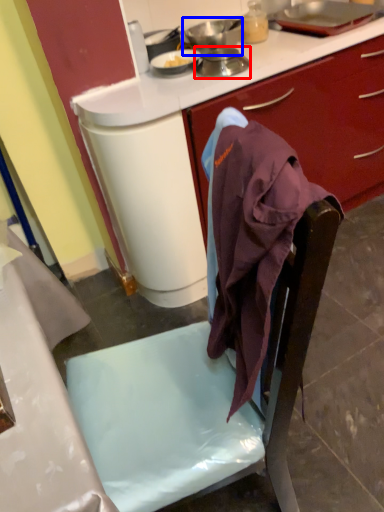
Question: Which object is closer to the camera taking this photo, kitchen appliance (highlighted by a red box) or kitchen appliance (highlighted by a blue box)?

Choices:
 (A) kitchen appliance
 (B) kitchen appliance

Answer: (A)